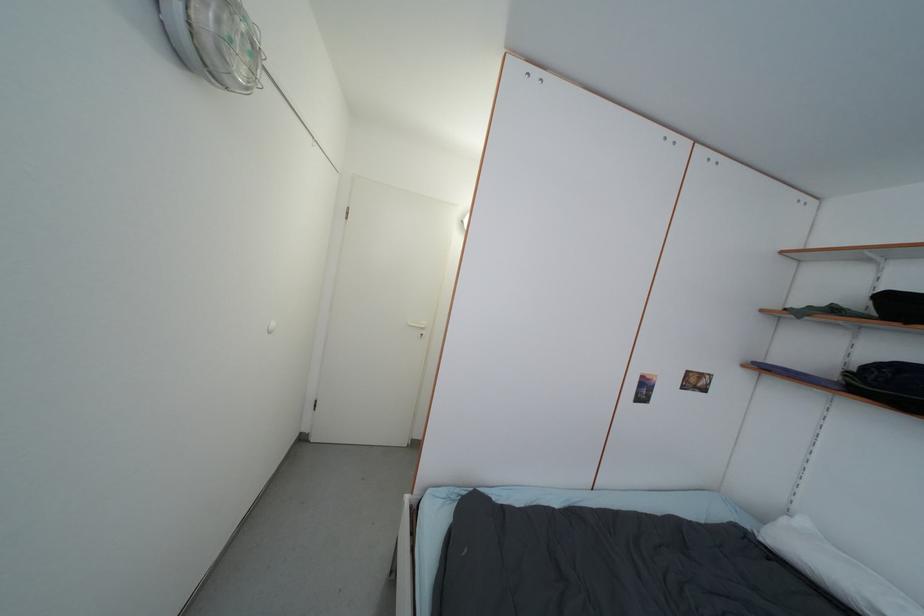
The image size is (924, 616). What do you see at coordinates (419, 326) in the screenshot?
I see `the white door handle` at bounding box center [419, 326].